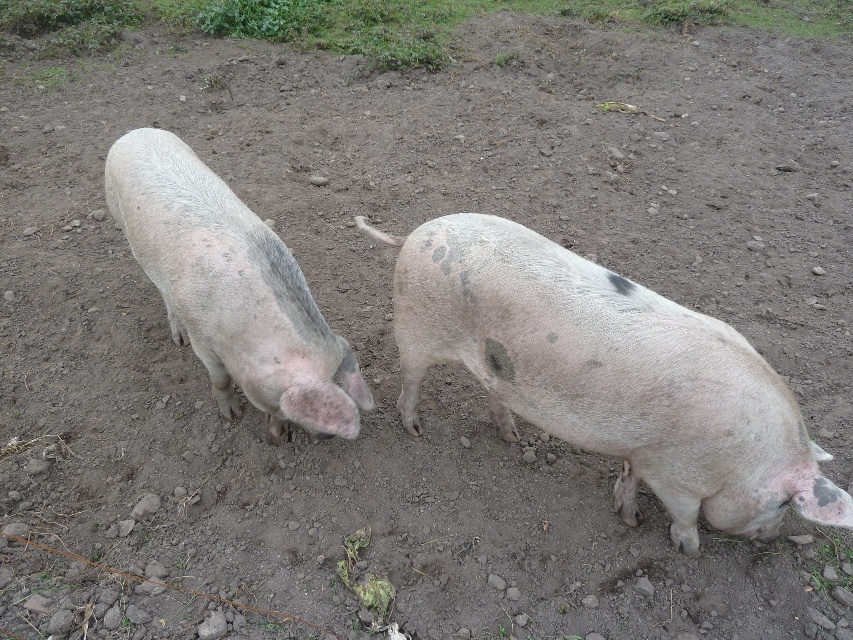
In the scene shown: You are a farmer who wants to separate the pigs by size for feeding. Based on the image, which pig should you feed first, the speckled pink pig at right or the gray matte pig at left?

The speckled pink pig at right is larger in size compared to the gray matte pig at left, so you should feed the speckled pink pig at right first.